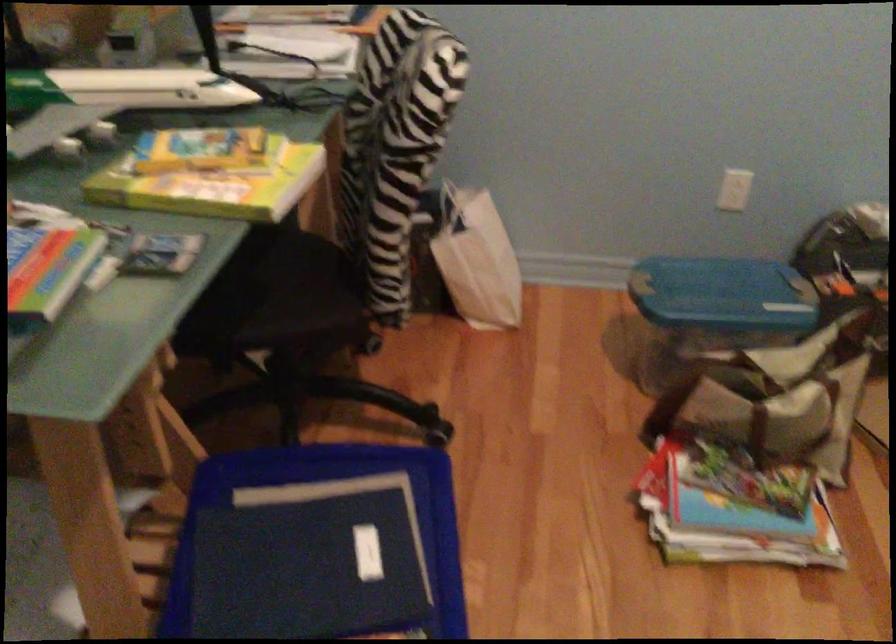
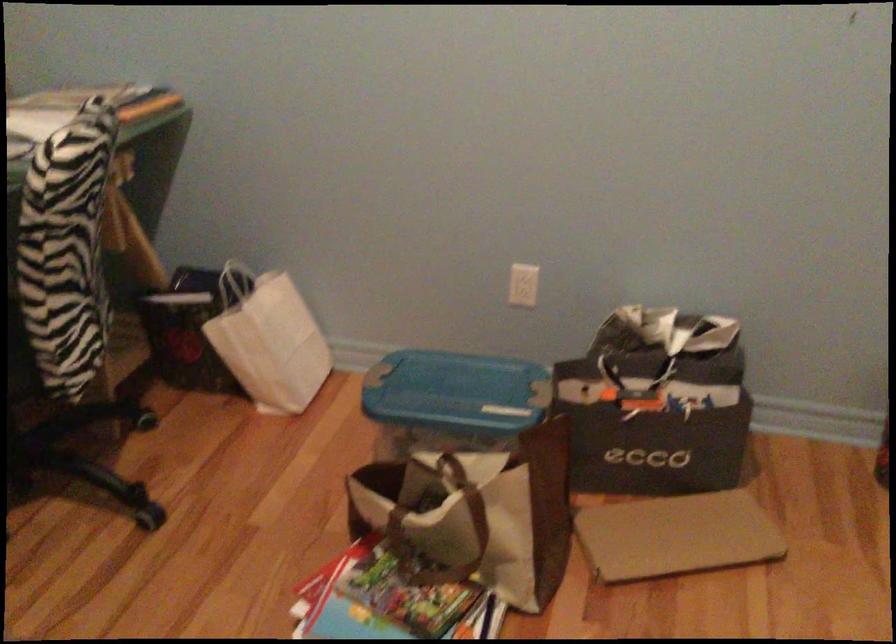
Locate, in the second image, the point that corresponds to (736,489) in the first image.

(388, 601)